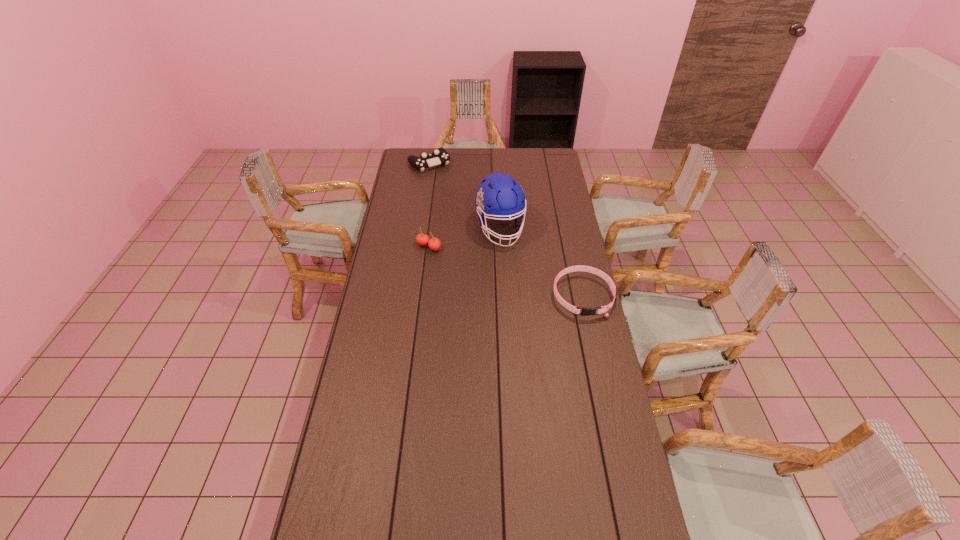
This screenshot has width=960, height=540. Identify the location of vacant space on the desktop that is between the cherry and the dog collar and is positioned on the surface of the farthest object. (519, 276).

The height and width of the screenshot is (540, 960). I want to click on vacant space on the desktop that is between the cherry and the rightmost object and is positioned on the face guard of the tallest object, so click(x=520, y=276).